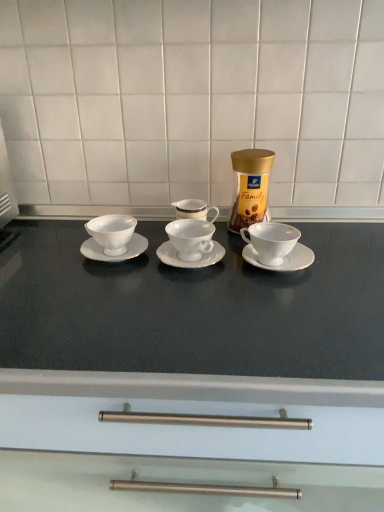
Locate an element on the screen. The height and width of the screenshot is (512, 384). vacant area located to the right-hand side of white ceramic saucer at right, positioned as the first saucer in right-to-left order is located at coordinates tap(347, 253).